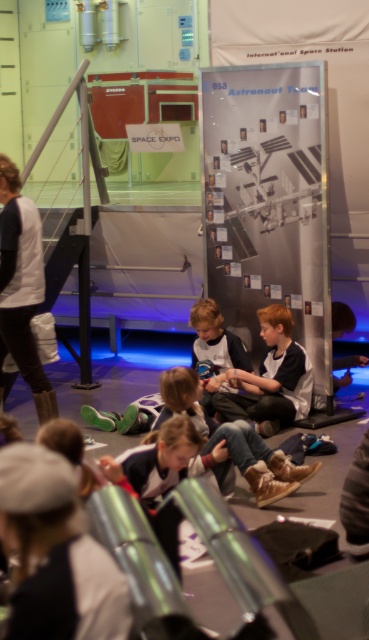
Question: Is matte black jacket at center to the left of light brown hair at center from the viewer's perspective?

Choices:
 (A) yes
 (B) no

Answer: (B)

Question: Which object appears closest to the camera in this image?

Choices:
 (A) light brown hair at center
 (B) matte black jacket at center

Answer: (B)

Question: Is matte black jacket at center to the left of light brown hair at center from the viewer's perspective?

Choices:
 (A) yes
 (B) no

Answer: (B)

Question: Which object appears farthest from the camera in this image?

Choices:
 (A) matte black jacket at center
 (B) light brown hair at center

Answer: (B)

Question: Is matte black jacket at center above light brown hair at center?

Choices:
 (A) yes
 (B) no

Answer: (B)

Question: Which object appears closest to the camera in this image?

Choices:
 (A) light brown hair at center
 (B) matte black jacket at center

Answer: (B)